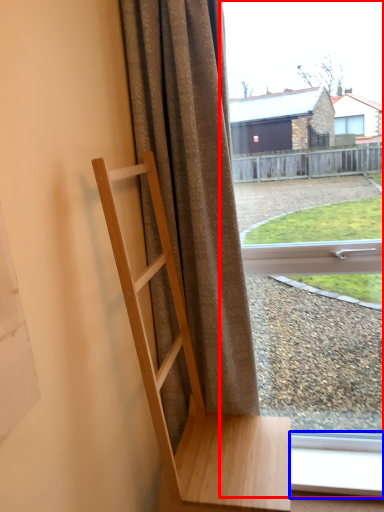
Question: Which of the following is the closest to the observer, window (highlighted by a red box) or window frame (highlighted by a blue box)?

Choices:
 (A) window
 (B) window frame

Answer: (A)